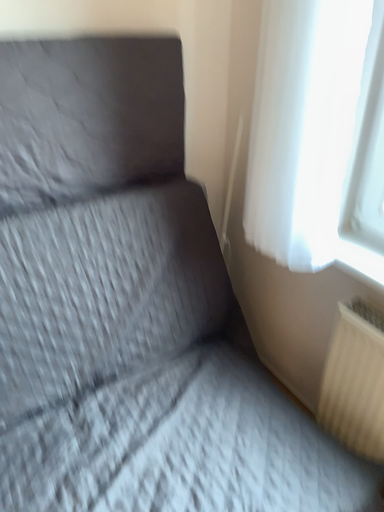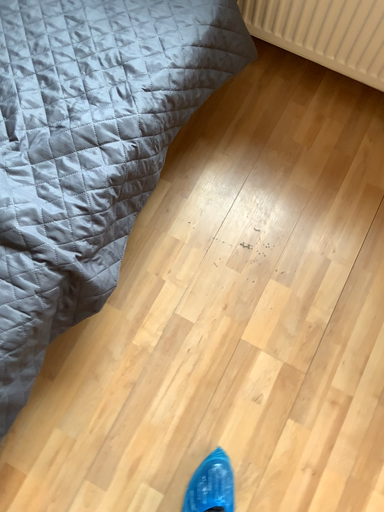
Question: How did the camera likely rotate when shooting the video?

Choices:
 (A) rotated upward
 (B) rotated downward

Answer: (B)